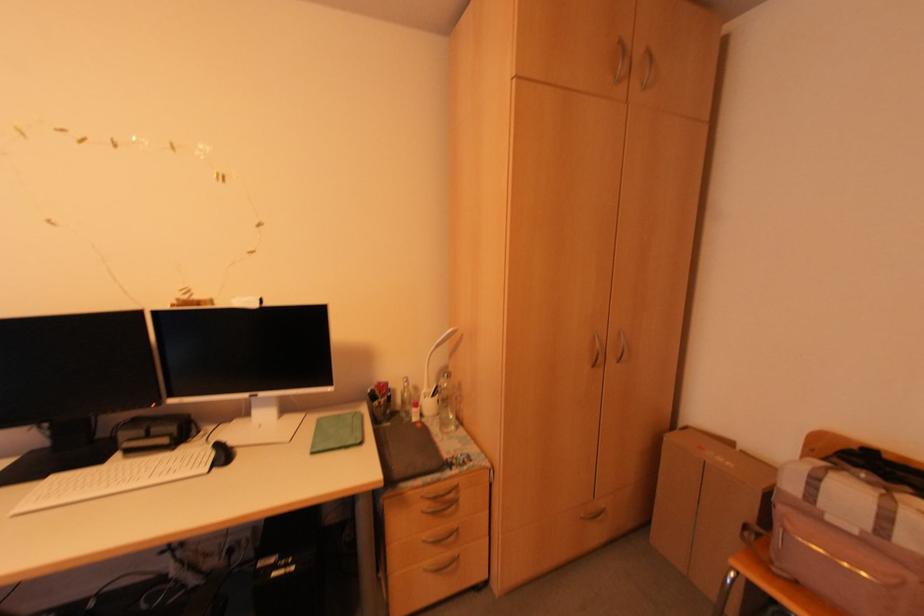
This screenshot has height=616, width=924. What do you see at coordinates (441, 564) in the screenshot?
I see `the wardrobe drawer handle` at bounding box center [441, 564].